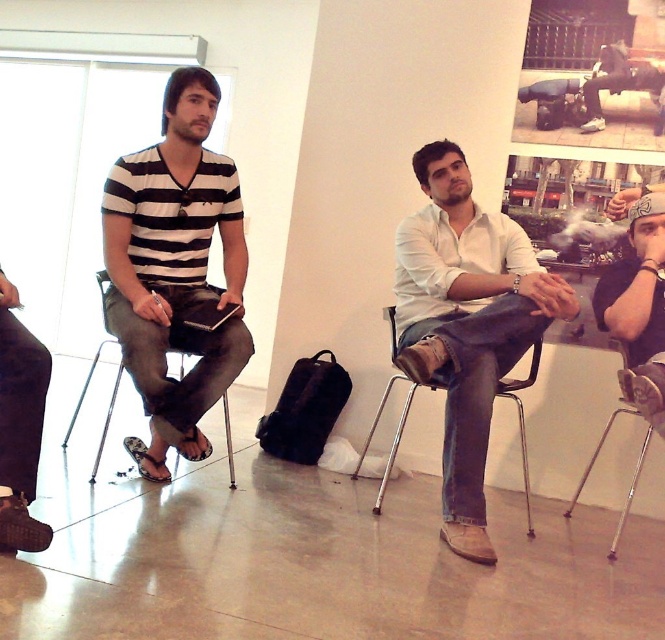
Can you confirm if metallic silver chair at center is positioned to the right of metallic silver chair at lower right?

No, metallic silver chair at center is not to the right of metallic silver chair at lower right.

Which is in front, point (523, 460) or point (632, 484)?

Point (632, 484)

Locate an element on the screen. metallic silver chair at center is located at coordinates (394, 433).

This screenshot has height=640, width=665. What do you see at coordinates (174, 269) in the screenshot? I see `striped cotton shirt at left` at bounding box center [174, 269].

From the picture: Does striped cotton shirt at left have a larger size compared to dark brown leather shoes at lower left?

Yes.

Locate an element on the screen. This screenshot has height=640, width=665. striped cotton shirt at left is located at coordinates (174, 269).

Between striped cotton shirt at left and metallic silver chair at center, which one appears on the left side from the viewer's perspective?

Positioned to the left is striped cotton shirt at left.

Image resolution: width=665 pixels, height=640 pixels. What do you see at coordinates (174, 269) in the screenshot?
I see `striped cotton shirt at left` at bounding box center [174, 269].

Between point (231, 180) and point (394, 307), which one is positioned in front?

Point (231, 180)

Find the location of `striped cotton shirt at left`. striped cotton shirt at left is located at coordinates (174, 269).